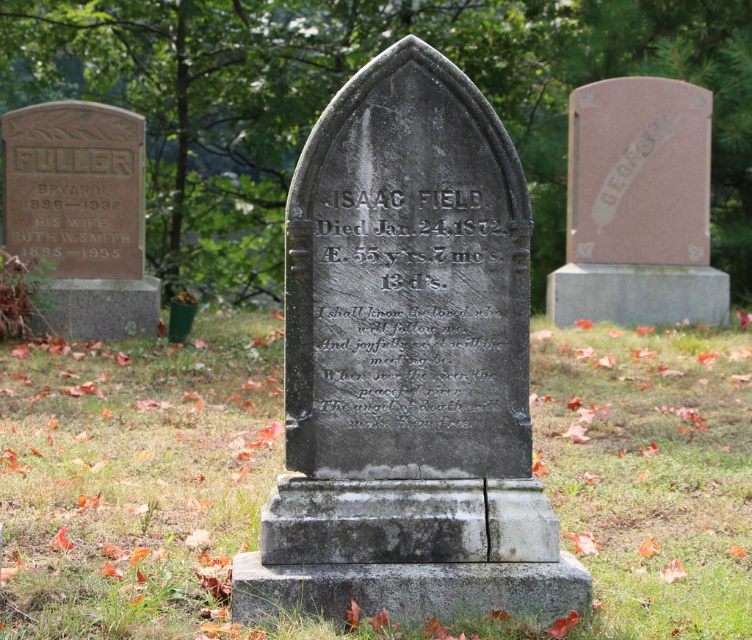
Is gray stone gravestone at center thinner than green leafy tree at center?

No, gray stone gravestone at center is not thinner than green leafy tree at center.

Who is more forward, [353,529] or [717,253]?

Positioned in front is point [353,529].

This screenshot has height=640, width=752. Find the location of `gray stone gravestone at center`. gray stone gravestone at center is located at coordinates (408, 365).

Between green grass at center and green leafy tree at center, which one is positioned higher?

green leafy tree at center

Who is positioned more to the left, green grass at center or green leafy tree at center?

From the viewer's perspective, green leafy tree at center appears more on the left side.

Which is in front, point (41, 468) or point (152, 212)?

Point (41, 468)

At what (x,y) coordinates should I click in order to perform the action: click on green grass at center. Please return your answer as a coordinate pair (x, y). Looking at the image, I should click on (135, 477).

Who is taller, green grass at center or gray stone gravestone at center?

gray stone gravestone at center

Does green grass at center appear on the right side of gray stone gravestone at center?

No, green grass at center is not to the right of gray stone gravestone at center.

Which is behind, point (77, 348) or point (472, 362)?

Point (77, 348)

At what (x,y) coordinates should I click in order to perform the action: click on green grass at center. Please return your answer as a coordinate pair (x, y). The height and width of the screenshot is (640, 752). Looking at the image, I should click on 135,477.